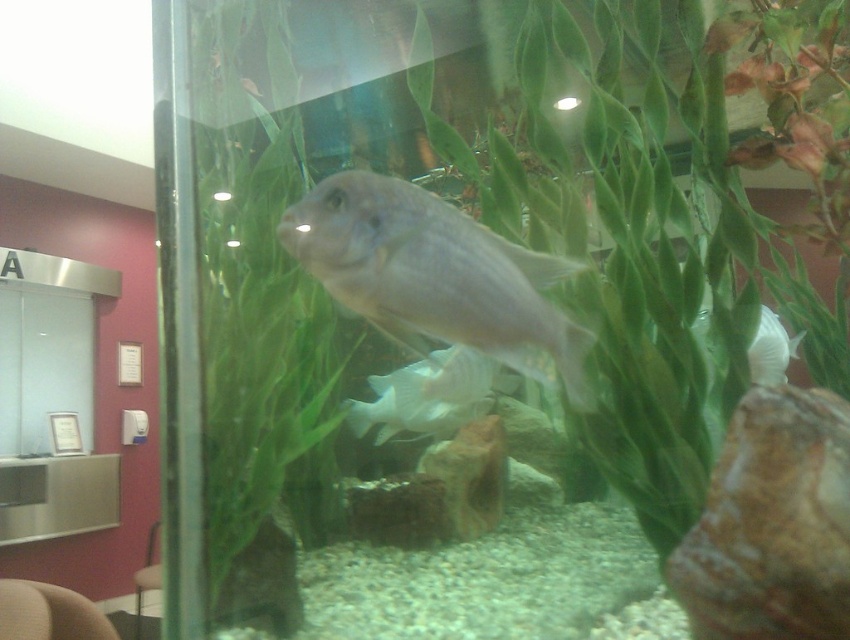
Question: Is matte gray fish at center positioned before white matte fish at center?

Choices:
 (A) no
 (B) yes

Answer: (B)

Question: Observing the image, what is the correct spatial positioning of white matte fish at center in reference to white matte shell at center?

Choices:
 (A) right
 (B) left

Answer: (B)

Question: Which object is the farthest from the matte gray fish at center?

Choices:
 (A) white matte fish at center
 (B) white matte shell at center

Answer: (A)

Question: Which of these objects is positioned closest to the white matte fish at center?

Choices:
 (A) matte gray fish at center
 (B) white matte shell at center

Answer: (B)

Question: Among these objects, which one is farthest from the camera?

Choices:
 (A) matte gray fish at center
 (B) white matte fish at center

Answer: (B)

Question: Does matte gray fish at center have a lesser width compared to white matte shell at center?

Choices:
 (A) no
 (B) yes

Answer: (A)